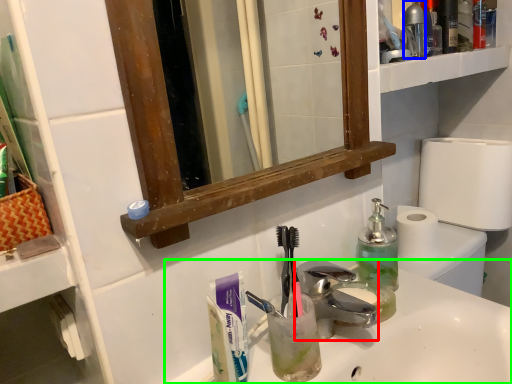
Question: Which object is positioned farthest from faucet (highlighted by a red box)? Select from bottle (highlighted by a blue box) and sink (highlighted by a green box).

Choices:
 (A) bottle
 (B) sink

Answer: (A)